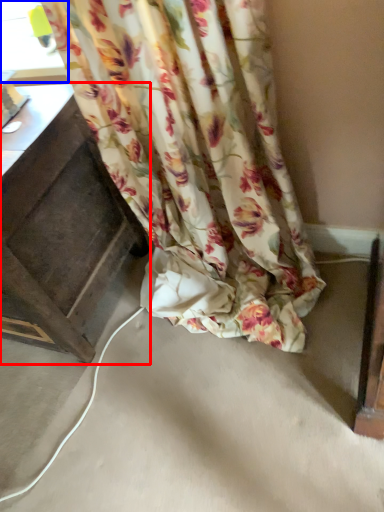
Question: Among these objects, which one is nearest to the camera, furniture (highlighted by a red box) or window (highlighted by a blue box)?

Choices:
 (A) furniture
 (B) window

Answer: (A)